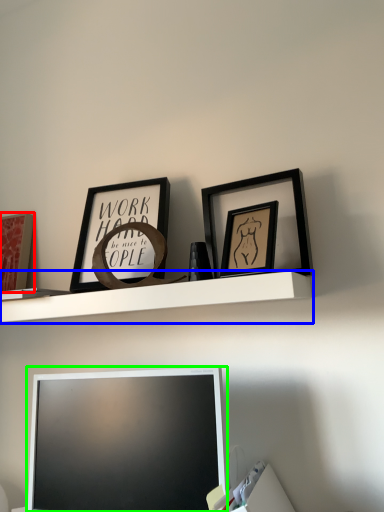
Question: Considering the real-world distances, which object is closest to picture frame (highlighted by a red box)? shelf (highlighted by a blue box) or television (highlighted by a green box).

Choices:
 (A) shelf
 (B) television

Answer: (A)